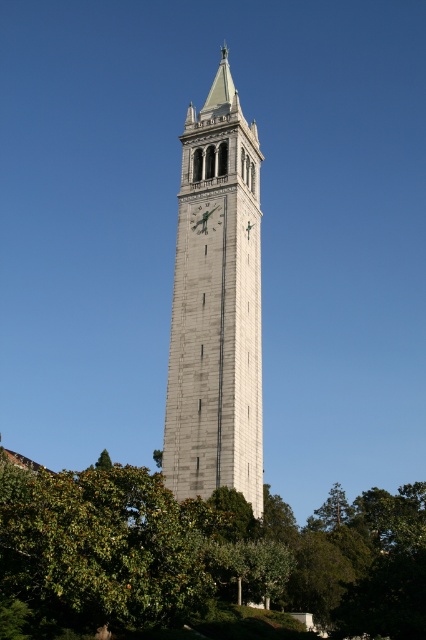
Which of these two, green leafy tree at lower left or green metallic clock at center, stands taller?

With more height is green leafy tree at lower left.

Describe the element at coordinates (201, 557) in the screenshot. This screenshot has height=640, width=426. I see `green leafy tree at lower left` at that location.

Image resolution: width=426 pixels, height=640 pixels. Identify the location of green leafy tree at lower left. (201, 557).

Is white stone clock tower at center bigger than green metallic clock at center?

Indeed, white stone clock tower at center has a larger size compared to green metallic clock at center.

The image size is (426, 640). What do you see at coordinates (216, 307) in the screenshot? I see `white stone clock tower at center` at bounding box center [216, 307].

Identify the location of white stone clock tower at center. The image size is (426, 640). (216, 307).

Is green leafy tree at lower left closer to camera compared to white stone clock tower at center?

Yes, green leafy tree at lower left is closer to the viewer.

Between green leafy tree at lower left and white stone clock tower at center, which one appears on the right side from the viewer's perspective?

From the viewer's perspective, green leafy tree at lower left appears more on the right side.

Which is in front, point (135, 566) or point (172, 323)?

Positioned in front is point (135, 566).

Find the location of a particular element. green leafy tree at lower left is located at coordinates (201, 557).